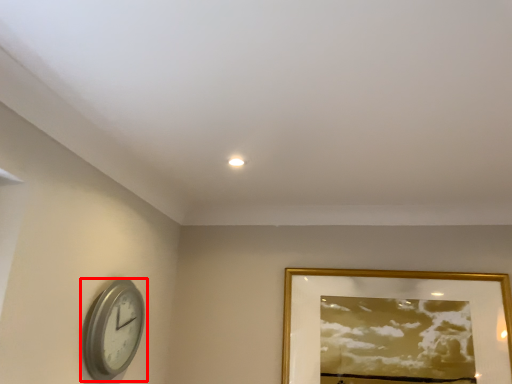
Question: From the image's perspective, where is wall clock (annotated by the red box) located relative to picture frame?

Choices:
 (A) below
 (B) above

Answer: (B)